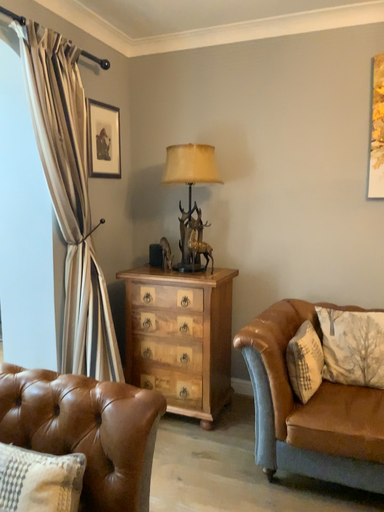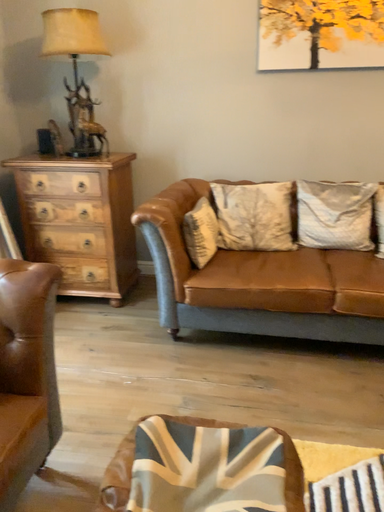
Question: Which way did the camera rotate in the video?

Choices:
 (A) rotated downward
 (B) rotated upward

Answer: (A)